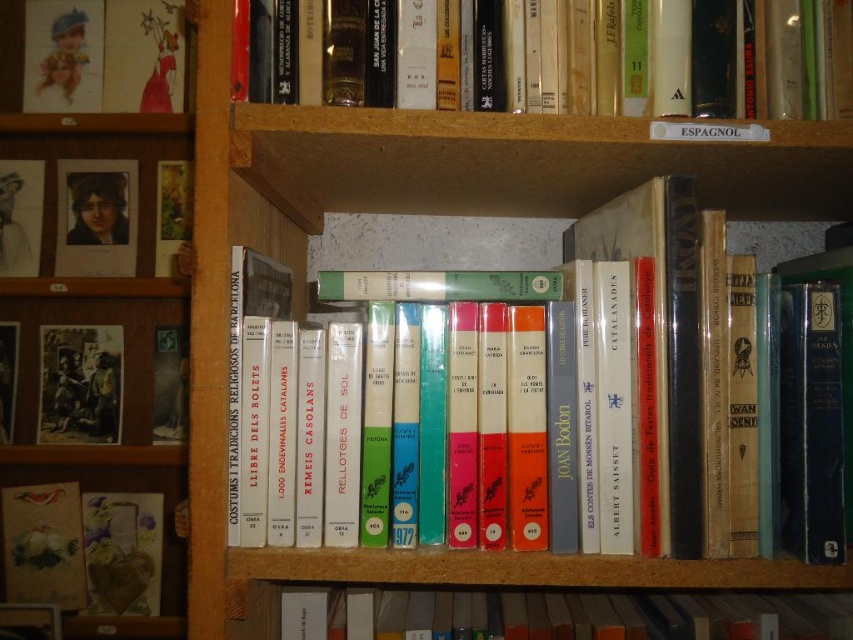
Question: Which point is farther to the camera?

Choices:
 (A) hardcover book at upper center
 (B) hardcover book at center
 (C) matte black photograph at left

Answer: (C)

Question: Is hardcover book at upper center bigger than hardcover books at center?

Choices:
 (A) no
 (B) yes

Answer: (A)

Question: Among these points, which one is nearest to the camera?

Choices:
 (A) (117, 340)
 (B) (712, 502)
 (C) (3, 524)

Answer: (B)

Question: Can you confirm if wooden bookshelf at center is positioned above matte black photograph at left?

Choices:
 (A) yes
 (B) no

Answer: (A)

Question: Considering the real-world distances, which object is farthest from the wooden bookshelf at center?

Choices:
 (A) matte black photograph at left
 (B) hardcover book at upper center

Answer: (B)

Question: Does wooden bookshelf at center appear on the right side of matte cardboard book at lower left?

Choices:
 (A) no
 (B) yes

Answer: (B)